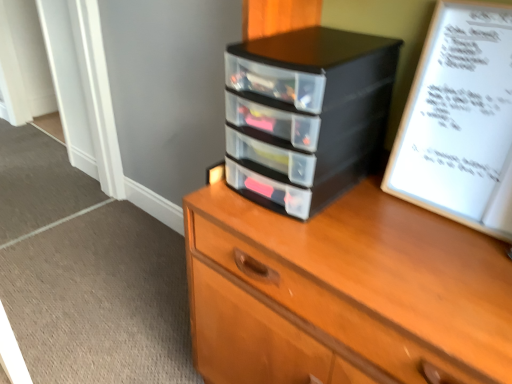
Question: Is white paper at upper right surrounding black plastic drawers at center?

Choices:
 (A) no
 (B) yes

Answer: (A)

Question: Can you confirm if white paper at upper right is shorter than black plastic drawers at center?

Choices:
 (A) yes
 (B) no

Answer: (B)

Question: From a real-world perspective, is white paper at upper right located higher than black plastic drawers at center?

Choices:
 (A) no
 (B) yes

Answer: (B)

Question: Is the depth of white paper at upper right less than that of black plastic drawers at center?

Choices:
 (A) no
 (B) yes

Answer: (B)

Question: Is white paper at upper right thinner than black plastic drawers at center?

Choices:
 (A) no
 (B) yes

Answer: (B)

Question: From a real-world perspective, relative to black plastic drawers at center, is black plastic chest of drawers at center vertically above or below?

Choices:
 (A) below
 (B) above

Answer: (A)

Question: From the image's perspective, relative to black plastic drawers at center, is black plastic chest of drawers at center above or below?

Choices:
 (A) above
 (B) below

Answer: (B)

Question: Visually, is black plastic chest of drawers at center positioned to the left or to the right of black plastic drawers at center?

Choices:
 (A) right
 (B) left

Answer: (A)

Question: Based on their sizes in the image, would you say black plastic chest of drawers at center is bigger or smaller than black plastic drawers at center?

Choices:
 (A) big
 (B) small

Answer: (A)

Question: From the image's perspective, is white paper at upper right located above or below black plastic chest of drawers at center?

Choices:
 (A) below
 (B) above

Answer: (B)

Question: Considering their positions, is white paper at upper right located in front of or behind black plastic chest of drawers at center?

Choices:
 (A) front
 (B) behind

Answer: (B)

Question: From a real-world perspective, is white paper at upper right physically located above or below black plastic chest of drawers at center?

Choices:
 (A) below
 (B) above

Answer: (B)

Question: Do you think white paper at upper right is within black plastic chest of drawers at center, or outside of it?

Choices:
 (A) outside
 (B) inside

Answer: (B)

Question: Do you think black plastic drawers at center is within white paper at upper right, or outside of it?

Choices:
 (A) inside
 (B) outside

Answer: (B)

Question: In the image, is black plastic drawers at center positioned in front of or behind white paper at upper right?

Choices:
 (A) front
 (B) behind

Answer: (B)